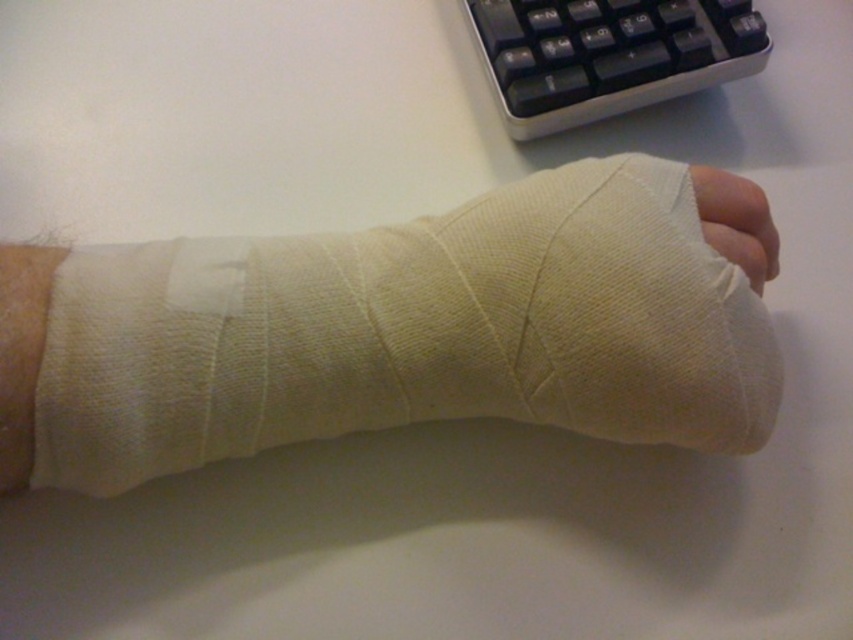
Does black plastic keyboard at upper right appear under white fabric bandage at center?

No, black plastic keyboard at upper right is not below white fabric bandage at center.

Which of these two, black plastic keyboard at upper right or white fabric bandage at center, stands shorter?

white fabric bandage at center is shorter.

What do you see at coordinates (608, 54) in the screenshot? I see `black plastic keyboard at upper right` at bounding box center [608, 54].

Locate an element on the screen. Image resolution: width=853 pixels, height=640 pixels. black plastic keyboard at upper right is located at coordinates (608, 54).

In the scene shown: Does white cloth bandage at center have a larger size compared to white fabric bandage at center?

Correct, white cloth bandage at center is larger in size than white fabric bandage at center.

Does white cloth bandage at center have a lesser height compared to white fabric bandage at center?

Incorrect, white cloth bandage at center's height does not fall short of white fabric bandage at center's.

Is point (550, 182) farther from viewer compared to point (753, 275)?

No.

Identify the location of white cloth bandage at center. (409, 332).

Is white cloth bandage at center closer to the viewer compared to black plastic keyboard at upper right?

That is True.

Locate an element on the screen. white cloth bandage at center is located at coordinates (409, 332).

Is point (729, 381) in front of point (550, 84)?

Yes, it is.

This screenshot has width=853, height=640. What are the coordinates of `white cloth bandage at center` in the screenshot? It's located at (409, 332).